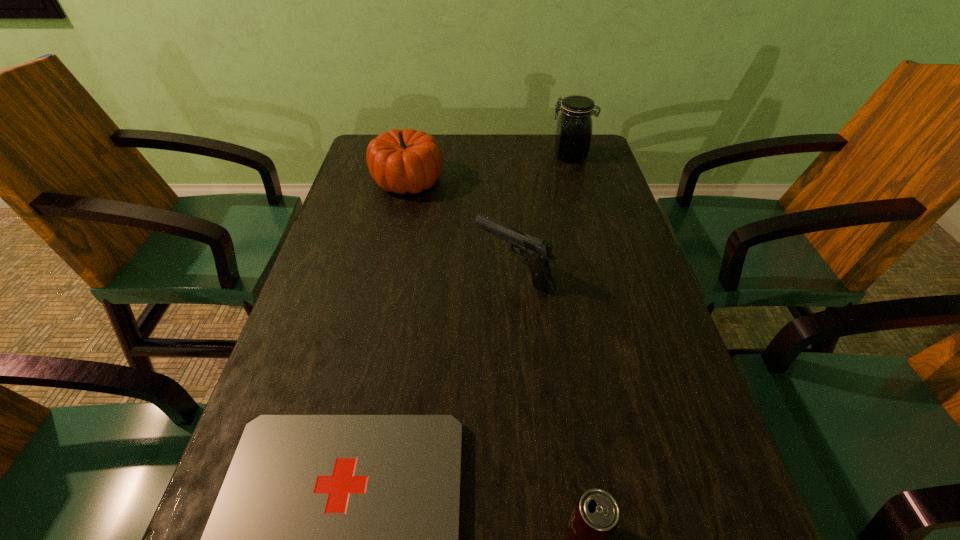
Identify the location of vacant area situated 0.150m at the muzzle of the third farthest object. Image resolution: width=960 pixels, height=540 pixels. (410, 274).

This screenshot has width=960, height=540. I want to click on jar at the far edge, so click(x=573, y=136).

Identify the location of pumpkin that is at the far edge. (400, 161).

Find the location of a particular element. object present at the left edge is located at coordinates (400, 161).

At what (x,y) coordinates should I click in order to perform the action: click on object that is at the right edge. Please return your answer as a coordinate pair (x, y). Looking at the image, I should click on (573, 136).

Identify the location of object that is at the far left corner. The width and height of the screenshot is (960, 540). (400, 161).

Locate an element on the screen. This screenshot has height=540, width=960. object at the far right corner is located at coordinates (573, 136).

Find the location of a particular element. free space at the far edge is located at coordinates (503, 163).

This screenshot has height=540, width=960. What are the coordinates of `blank space at the left edge of the desktop` in the screenshot? It's located at (289, 406).

Locate an element on the screen. The width and height of the screenshot is (960, 540). vacant region at the right edge of the desktop is located at coordinates (674, 374).